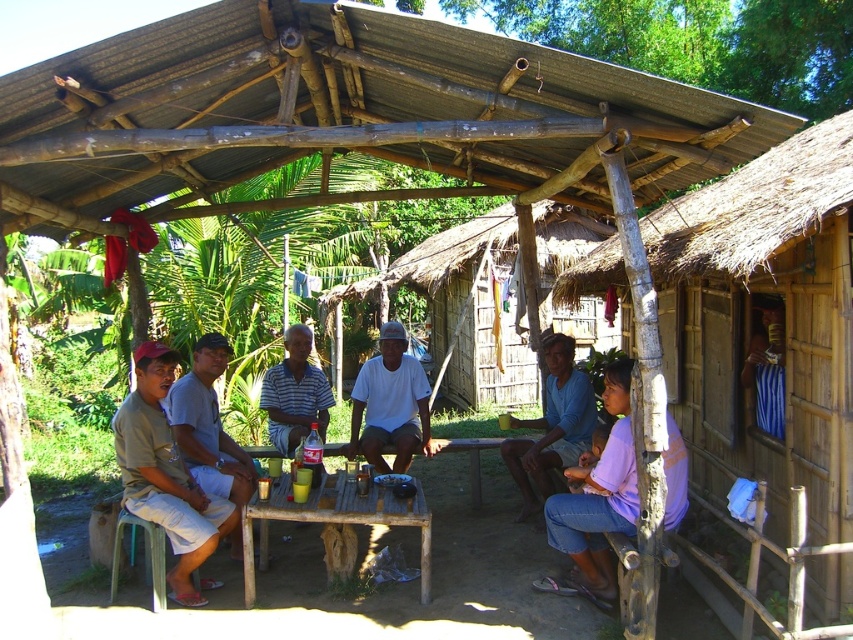
Question: Which point is closer to the camera taking this photo?

Choices:
 (A) (297, 380)
 (B) (795, 406)

Answer: (B)

Question: Considering the relative positions of thatched wood hut at right and striped fabric shirt at center in the image provided, where is thatched wood hut at right located with respect to striped fabric shirt at center?

Choices:
 (A) left
 (B) right

Answer: (B)

Question: Based on their relative distances, which object is farther from the wooden table at center?

Choices:
 (A) thatched wood hut at right
 (B) blue cotton shirt at center

Answer: (A)

Question: Is the position of thatched wood hut at right more distant than that of wooden table at center?

Choices:
 (A) yes
 (B) no

Answer: (B)

Question: Which of these objects is positioned farthest from the light brown fabric shirt at left?

Choices:
 (A) light brown plastic stool at lower left
 (B) thatched wood hut at right
 (C) purple cotton shirt at lower right
 (D) wooden table at center

Answer: (B)

Question: Can you confirm if light brown plastic stool at lower left is thinner than white matte shirt at center?

Choices:
 (A) yes
 (B) no

Answer: (B)